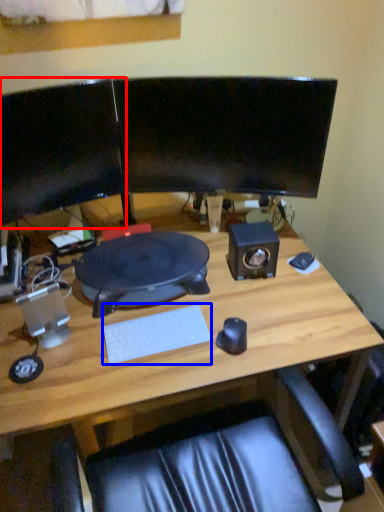
Question: Which point is closer to the camera, computer monitor (highlighted by a red box) or computer keyboard (highlighted by a blue box)?

Choices:
 (A) computer monitor
 (B) computer keyboard

Answer: (A)